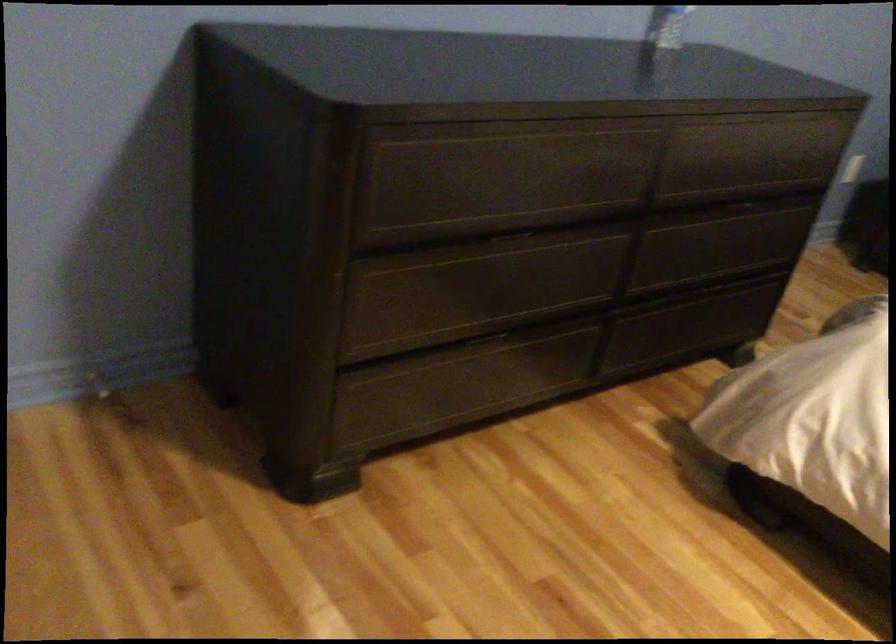
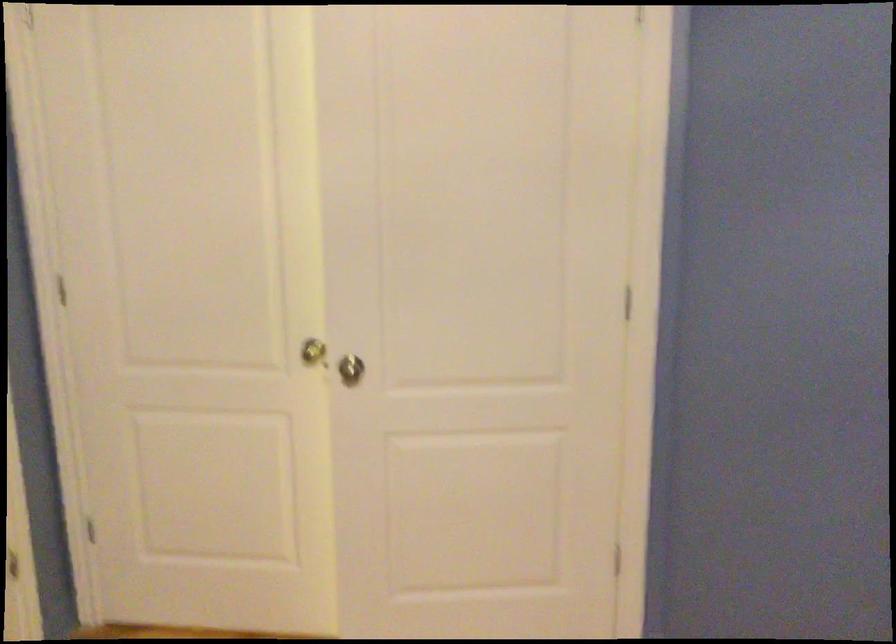
Question: The camera is either moving clockwise (left) or counter-clockwise (right) around the object. The first image is from the beginning of the video and the second image is from the end. Is the camera moving left or right when shooting the video?

Choices:
 (A) Left
 (B) Right

Answer: (B)